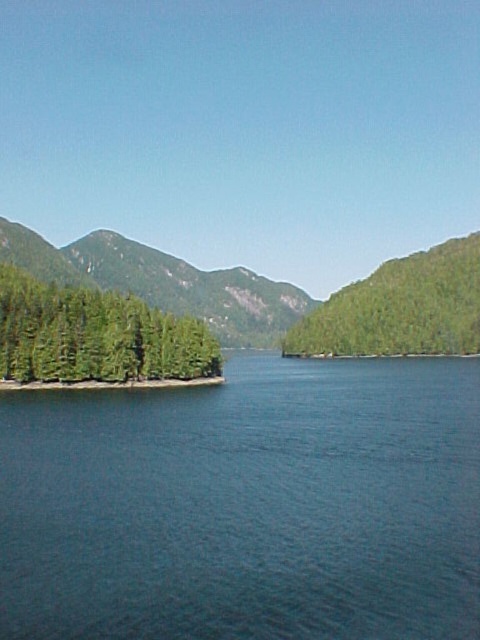
Who is shorter, green matte trees at left or green forested mountain at left?

With less height is green matte trees at left.

Describe the element at coordinates (95, 336) in the screenshot. I see `green matte trees at left` at that location.

Which is in front, point (146, 330) or point (135, 256)?

Point (146, 330) is in front.

Where is `green matte trees at left`? Image resolution: width=480 pixels, height=640 pixels. green matte trees at left is located at coordinates (95, 336).

The height and width of the screenshot is (640, 480). What do you see at coordinates (164, 282) in the screenshot?
I see `green forested mountain at left` at bounding box center [164, 282].

Can you confirm if green forested mountain at left is positioned to the right of green matte tree at center-right?

In fact, green forested mountain at left is to the left of green matte tree at center-right.

At what (x,y) coordinates should I click in order to perform the action: click on green forested mountain at left. Please return your answer as a coordinate pair (x, y). This screenshot has height=640, width=480. Looking at the image, I should click on (164, 282).

Which of these two, green matte trees at left or green matte tree at center-right, stands shorter?

Standing shorter between the two is green matte trees at left.

The image size is (480, 640). I want to click on green matte trees at left, so click(95, 336).